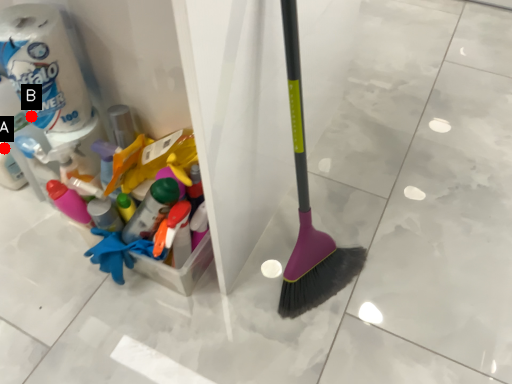
Question: Two points are circled on the image, labeled by A and B beside each circle. Which point is farther to the camera?

Choices:
 (A) A is further
 (B) B is further

Answer: (A)